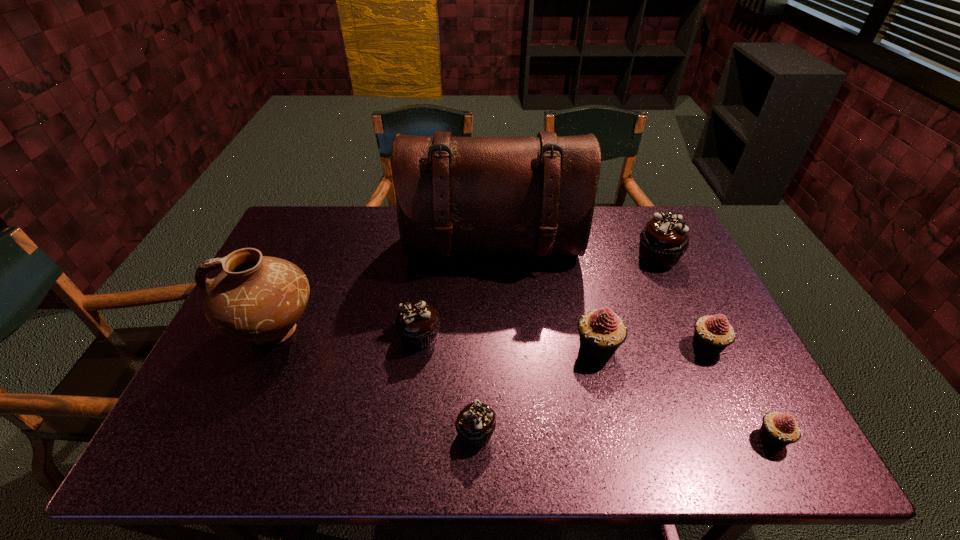
Identify the location of free point located on the back of the nearest pink cupcake. The image size is (960, 540). (702, 300).

At what (x,y) coordinates should I click in order to perform the action: click on satchel that is at the far edge. Please return your answer as a coordinate pair (x, y). The height and width of the screenshot is (540, 960). Looking at the image, I should click on (470, 195).

What are the coordinates of `cupcake that is positioned at the far edge` in the screenshot? It's located at (664, 239).

Locate an element on the screen. The image size is (960, 540). object situated at the left edge is located at coordinates (257, 298).

The width and height of the screenshot is (960, 540). In order to click on object at the far right corner in this screenshot , I will do `click(664, 239)`.

Identify the location of object positioned at the near right corner. [778, 430].

The width and height of the screenshot is (960, 540). I want to click on vacant region at the far edge of the desktop, so click(393, 206).

Find the location of a particular element. free space at the near edge of the desktop is located at coordinates (604, 427).

The image size is (960, 540). Find the location of `blank area at the right edge`. blank area at the right edge is located at coordinates (684, 295).

Find the location of `free spot between the second nearest brown cupcake and the pottery`. free spot between the second nearest brown cupcake and the pottery is located at coordinates (348, 334).